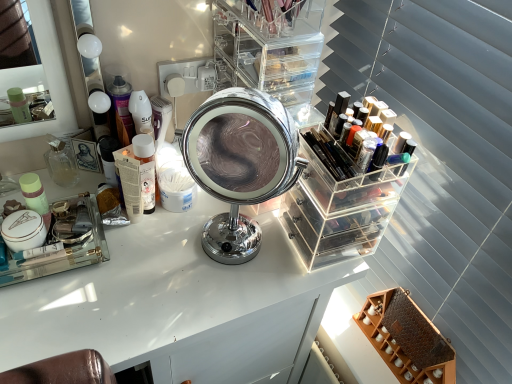
The image size is (512, 384). I want to click on vacant space behind chrome/metallic mirror at center, so click(240, 212).